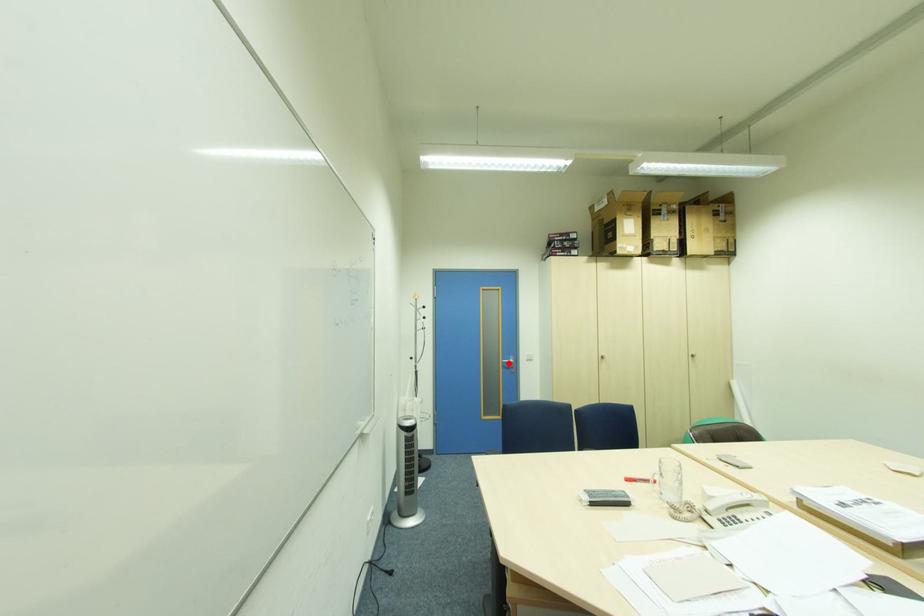
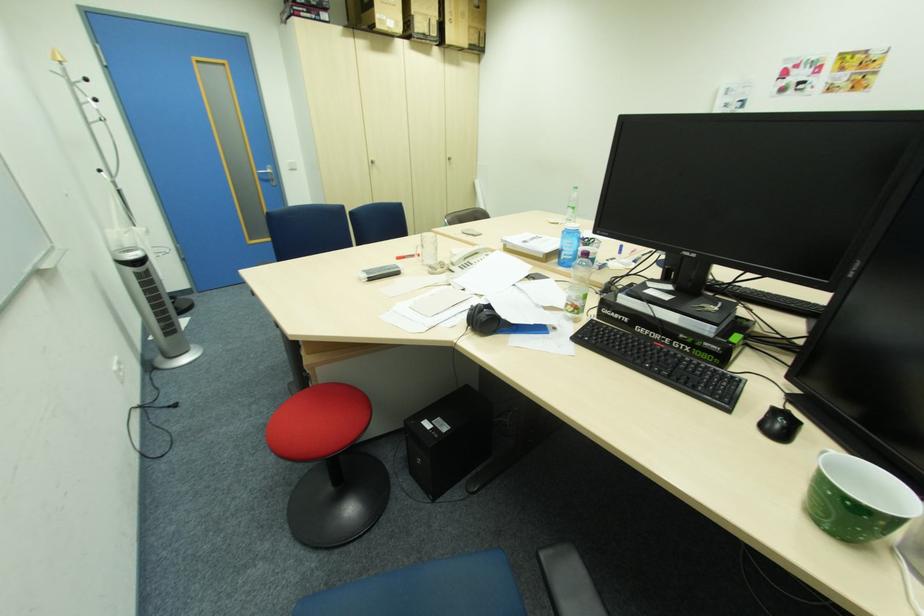
In the second image, find the point that corresponds to the highlighted location in the first image.

(264, 174)